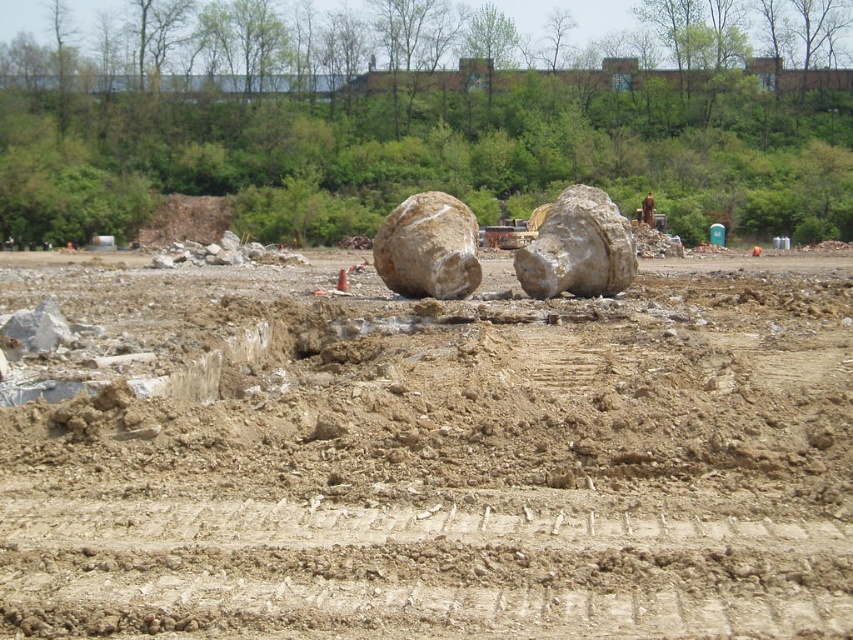
How much distance is there between brown sandy dirt at center and rough beige boulder at center?

brown sandy dirt at center is 5.59 meters away from rough beige boulder at center.

Can you confirm if brown sandy dirt at center is shorter than rough beige boulder at center?

Incorrect, brown sandy dirt at center's height does not fall short of rough beige boulder at center's.

The height and width of the screenshot is (640, 853). Identify the location of brown sandy dirt at center. (430, 456).

Is smooth gray rock at center taller than rough beige boulder at center?

Indeed, smooth gray rock at center has a greater height compared to rough beige boulder at center.

Can you confirm if smooth gray rock at center is smaller than rough beige boulder at center?

No, smooth gray rock at center is not smaller than rough beige boulder at center.

Who is more forward, (630, 278) or (415, 241)?

Point (415, 241) is more forward.

The height and width of the screenshot is (640, 853). Find the location of `smooth gray rock at center`. smooth gray rock at center is located at coordinates (578, 248).

Is brown sandy dirt at center to the left of smooth gray rock at center from the viewer's perspective?

Indeed, brown sandy dirt at center is positioned on the left side of smooth gray rock at center.

Is point (398, 465) more distant than point (583, 276)?

No, it is in front of (583, 276).

Which is in front, point (799, 513) or point (564, 237)?

Positioned in front is point (799, 513).

Find the location of a particular element. This screenshot has width=853, height=640. brown sandy dirt at center is located at coordinates (430, 456).